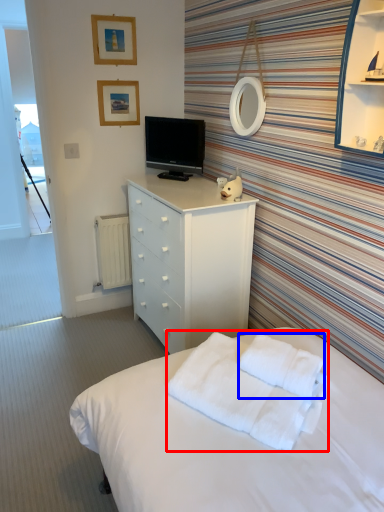
Question: Which point is further to the camera, blanket (highlighted by a red box) or cloth (highlighted by a blue box)?

Choices:
 (A) blanket
 (B) cloth

Answer: (B)